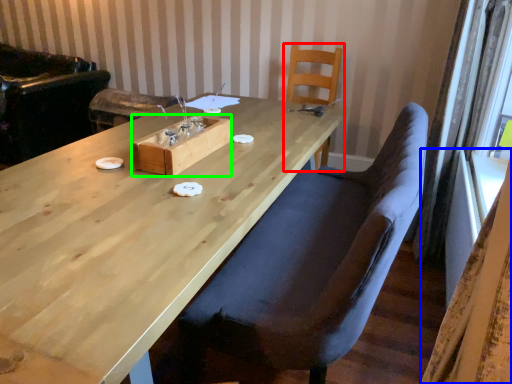
Question: Which object is positioned closest to chair (highlighted by a red box)? Select from curtain (highlighted by a blue box) and wood (highlighted by a green box).

Choices:
 (A) curtain
 (B) wood

Answer: (B)